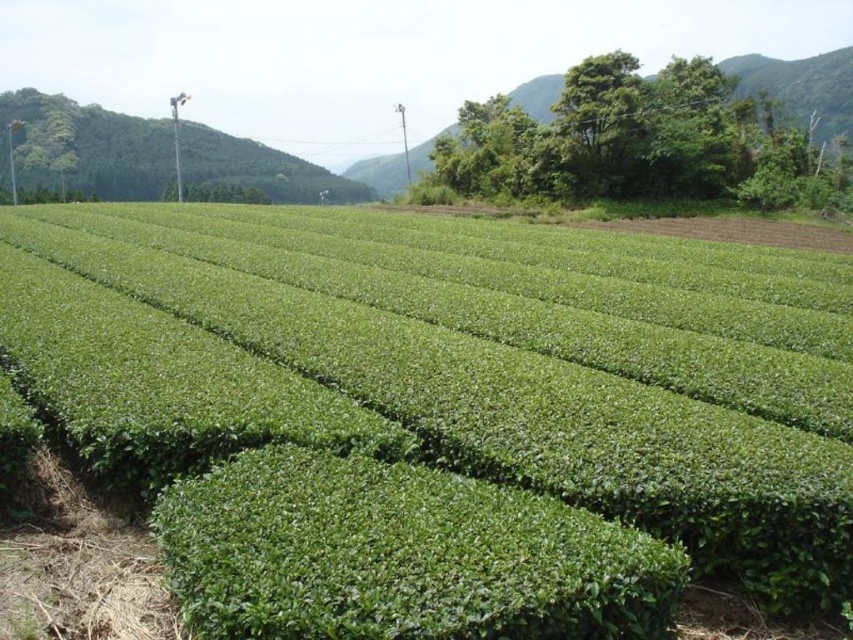
Is point (795, 392) less distant than point (776, 97)?

Yes, it is.

Which is behind, point (827, 353) or point (419, 148)?

The point (419, 148) is behind.

Does point (28, 237) come in front of point (817, 138)?

Yes.

The image size is (853, 640). What are the coordinates of `green leafy field at center` in the screenshot? It's located at (427, 435).